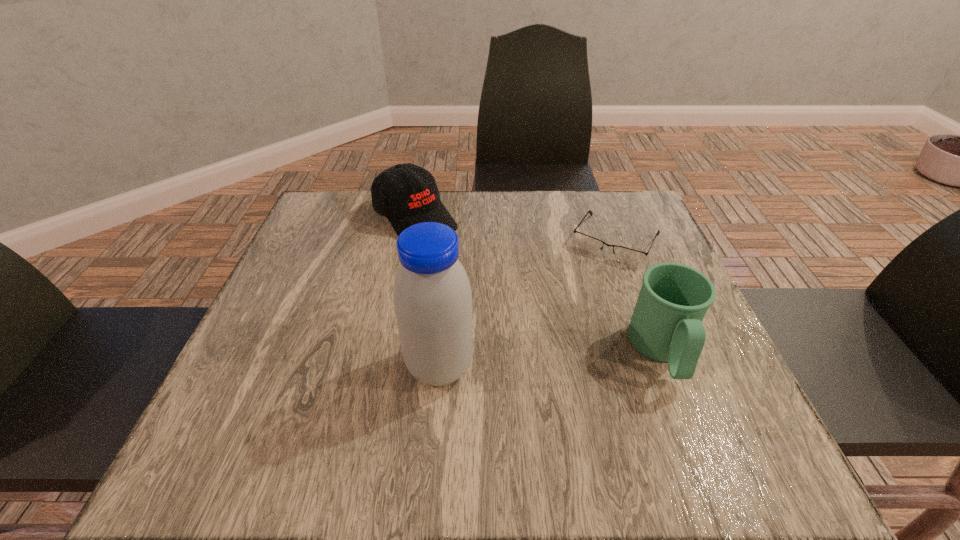
This screenshot has height=540, width=960. Identify the location of the tallest object. (432, 296).

I want to click on mug, so click(x=666, y=325).

This screenshot has width=960, height=540. I want to click on baseball cap, so click(x=407, y=194).

At what (x,y) coordinates should I click in order to perform the action: click on the shortest object. Please return your answer as a coordinate pair (x, y). Looking at the image, I should click on click(626, 255).

Where is `free space located on the back of the soya milk`? free space located on the back of the soya milk is located at coordinates (446, 287).

Identify the location of free space located on the side of the mug with the handle. Image resolution: width=960 pixels, height=540 pixels. (687, 418).

At what (x,y) coordinates should I click in order to perform the action: click on vacant space located 0.240m on the front-facing side of the baseball cap. Please return your answer as a coordinate pair (x, y). This screenshot has width=960, height=540. Looking at the image, I should click on (x=502, y=295).

Locate an element on the screen. The width and height of the screenshot is (960, 540). free space located 0.130m on the front-facing side of the baseball cap is located at coordinates (471, 268).

You are a GUI agent. You are given a task and a screenshot of the screen. Output one action in this format:
    pyautogui.click(x=<x>, y=<y>)
    Task: Click on the free space located 0.280m on the front-facing side of the baseball cap
    
    Given the screenshot: What is the action you would take?
    pyautogui.click(x=515, y=306)

Image resolution: width=960 pixels, height=540 pixels. Identify the location of vacant region located on the front-facing side of the shortest object. (562, 333).